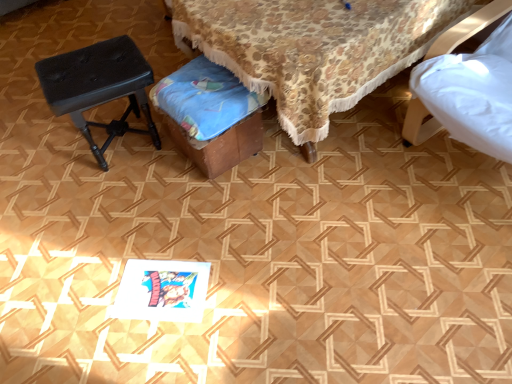
Question: From a real-world perspective, is black leather stool at left positioned above or below wooden stool at center?

Choices:
 (A) above
 (B) below

Answer: (B)

Question: Does point (97, 49) appear closer or farther from the camera than point (260, 39)?

Choices:
 (A) closer
 (B) farther

Answer: (B)

Question: Which object is the closest to the wooden music stool at center?

Choices:
 (A) wooden stool at center
 (B) black leather stool at left

Answer: (A)

Question: Which of these objects is positioned farthest from the wooden stool at center?

Choices:
 (A) black leather stool at left
 (B) wooden music stool at center

Answer: (A)